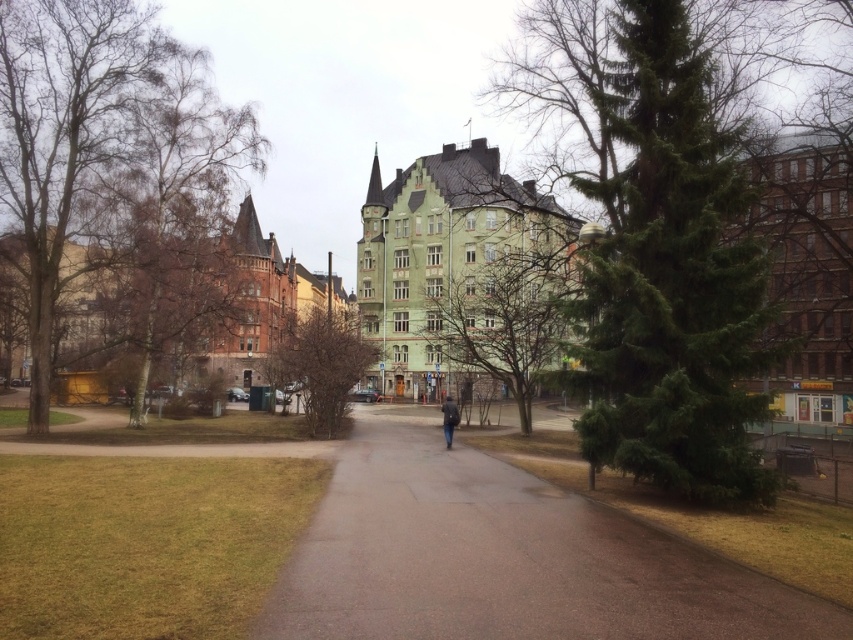
You are a gardener planning to plant a new tree in the park. You have a limited space of 3 meters in width. You see the green textured tree at center and the bare birch tree at left. Which tree would be more suitable to plant in this space based on their widths?

The bare birch tree at left has a smaller width than the green textured tree at center, so it would be more suitable to plant in the 3 meter width space.

You are standing at the entrance of the park and want to reach the green textured tree at center. According to the map, your current position is at point 0.0, 0.0. In which general direction should you walk to reach the tree?

The green textured tree at center is located at point [669,273]. Since your current position is at [0,0], you should walk northeast to reach the tree.

You are a pedestrian walking along the paved pathway in the urban park scene. You notice the bare birch tree at left and the green matte tree at center. Which tree is positioned closer to the left side of the path?

The bare birch tree at left is positioned closer to the left side of the path compared to the green matte tree at center.